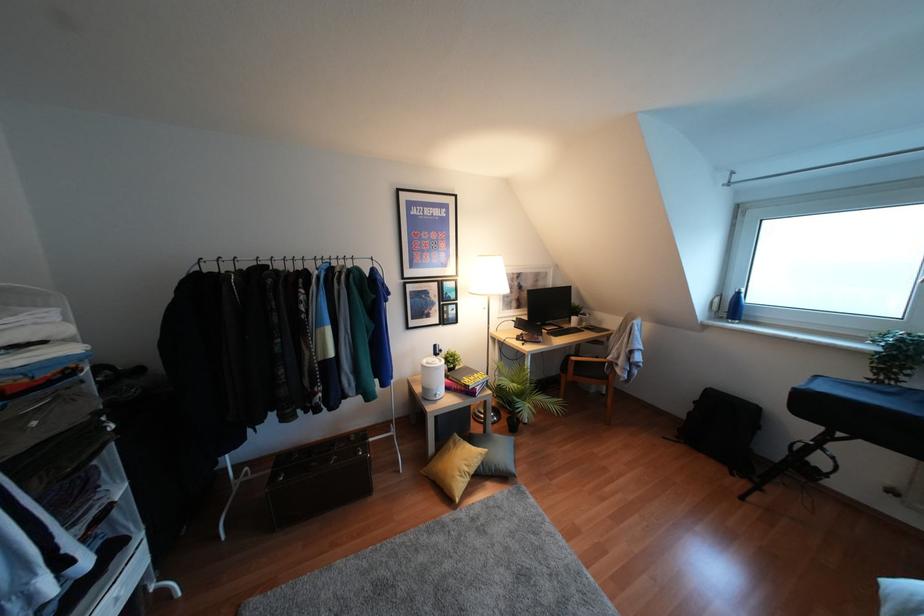
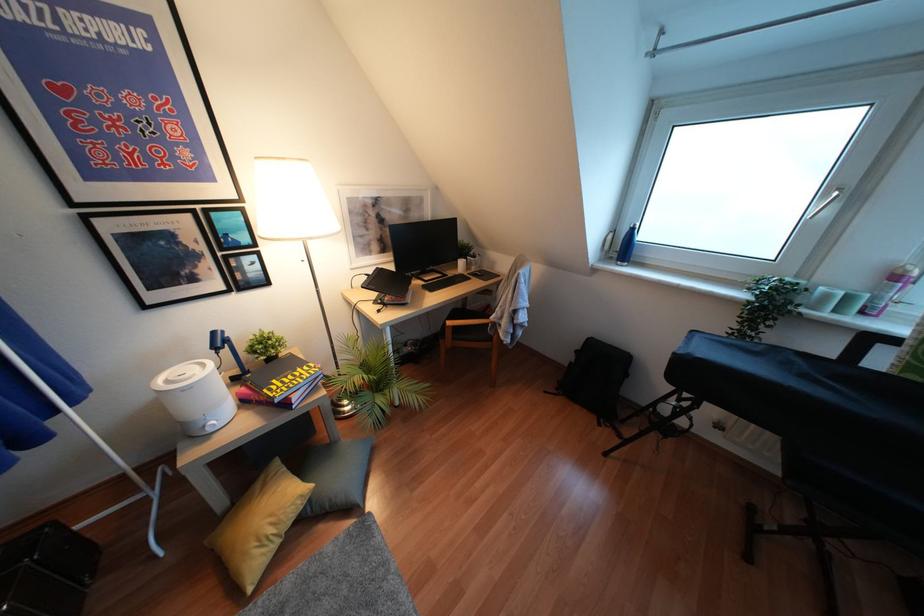
Locate, in the second image, the point that corresponds to point 436,397 in the first image.

(210, 430)